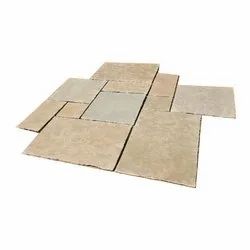
Image resolution: width=250 pixels, height=250 pixels. Identify the location of the smallest tiles. (68, 109), (161, 102).